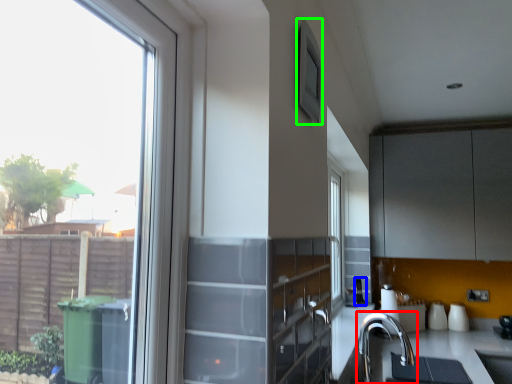
Question: Which object is positioned farthest from tap (highlighted by a red box)? Select from appliance (highlighted by a blue box) and window screen (highlighted by a green box).

Choices:
 (A) appliance
 (B) window screen

Answer: (B)